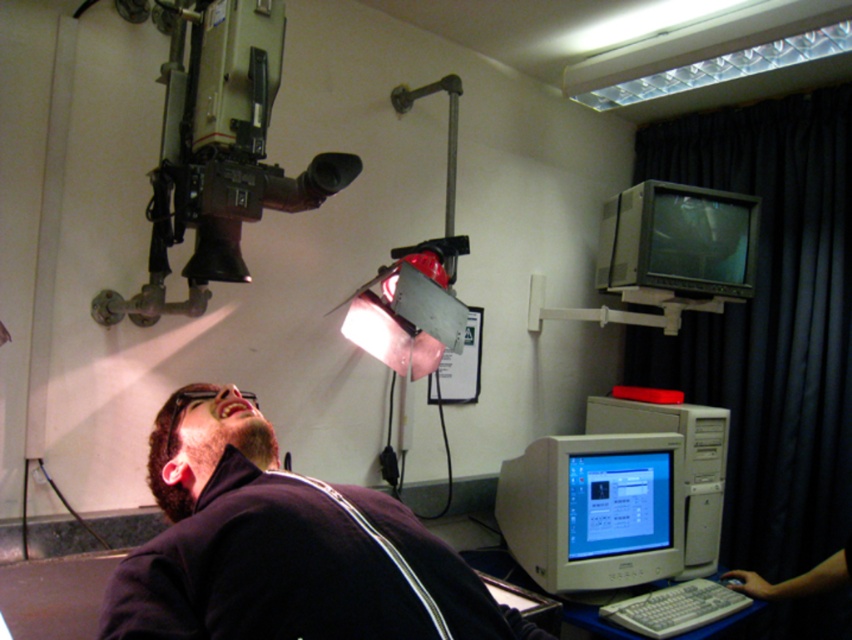
Question: Does metallic gray video camera at upper left come behind beige plastic monitor at lower center?

Choices:
 (A) no
 (B) yes

Answer: (A)

Question: In this image, where is matte gray monitor at upper right located relative to white plastic computer at lower right?

Choices:
 (A) right
 (B) left

Answer: (B)

Question: Among these points, which one is farthest from the camera?

Choices:
 (A) (367, 592)
 (B) (540, 451)
 (C) (665, 420)

Answer: (C)

Question: Is matte gray monitor at upper right closer to camera compared to matte gray monitor at center?

Choices:
 (A) yes
 (B) no

Answer: (B)

Question: Estimate the real-world distances between objects in this image. Which object is farther from the dark matte jacket at lower center?

Choices:
 (A) matte gray monitor at upper right
 (B) white plastic computer at lower right

Answer: (A)

Question: Which object is farther from the camera taking this photo?

Choices:
 (A) matte gray monitor at center
 (B) beige plastic monitor at lower center
 (C) matte gray monitor at upper right
 (D) dark matte jacket at lower center

Answer: (C)